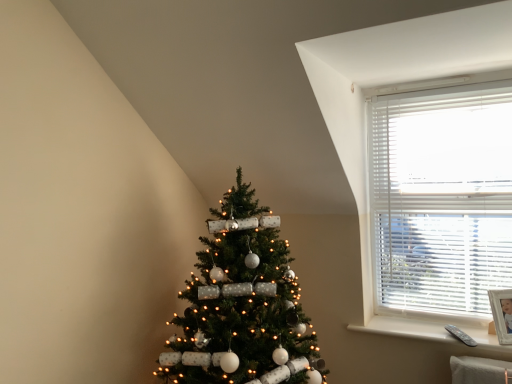
This screenshot has width=512, height=384. I want to click on white blinds at upper right, so click(x=441, y=194).

What do you see at coordinates (406, 328) in the screenshot? The image size is (512, 384). I see `white plastic remote at lower right` at bounding box center [406, 328].

At what (x,y) coordinates should I click in order to perform the action: click on green matte christmas tree at center. Please return your answer as a coordinate pair (x, y). Image resolution: width=512 pixels, height=384 pixels. Looking at the image, I should click on (242, 305).

I want to click on white blinds at upper right, so click(x=441, y=194).

Is white blinds at upper right wider than green matte christmas tree at center?

Incorrect, the width of white blinds at upper right does not surpass that of green matte christmas tree at center.

Consider the image. Would you consider white blinds at upper right to be distant from green matte christmas tree at center?

Actually, white blinds at upper right and green matte christmas tree at center are a little close together.

From the image's perspective, would you say white blinds at upper right is shown under green matte christmas tree at center?

No, from the image's perspective, white blinds at upper right is not beneath green matte christmas tree at center.

Is white blinds at upper right facing towards green matte christmas tree at center?

No, white blinds at upper right does not turn towards green matte christmas tree at center.

Would you say white plastic remote at lower right is inside or outside green matte christmas tree at center?

The correct answer is: outside.

Is white plastic remote at lower right further to camera compared to green matte christmas tree at center?

Yes, white plastic remote at lower right is further from the camera.

Based on the photo, is white plastic remote at lower right to the right of green matte christmas tree at center from the viewer's perspective?

Yes, white plastic remote at lower right is to the right of green matte christmas tree at center.

Between point (431, 339) and point (263, 248), which one is positioned in front?

Point (263, 248)

Considering the positions of points (438, 332) and (463, 220), is point (438, 332) closer to camera compared to point (463, 220)?

Yes.

From the image's perspective, which object appears higher, white plastic remote at lower right or white blinds at upper right?

white blinds at upper right appears higher in the image.

Is white plastic remote at lower right next to white blinds at upper right and touching it?

There is a gap between white plastic remote at lower right and white blinds at upper right.

Which is correct: white blinds at upper right is inside white plastic remote at lower right, or outside of it?

The correct answer is: outside.

From the image's perspective, is white blinds at upper right on white plastic remote at lower right?

Yes, from the image's perspective, white blinds at upper right is above white plastic remote at lower right.

Identify the location of window located above the white plastic remote at lower right (from a real-world perspective). The width and height of the screenshot is (512, 384). (x=441, y=194).

From the image's perspective, which object appears higher, green matte christmas tree at center or white plastic remote at lower right?

green matte christmas tree at center.

Between green matte christmas tree at center and white plastic remote at lower right, which one has less height?

white plastic remote at lower right.

In the scene shown: Considering the positions of objects green matte christmas tree at center and white plastic remote at lower right in the image provided, who is more to the right, green matte christmas tree at center or white plastic remote at lower right?

white plastic remote at lower right is more to the right.

Is green matte christmas tree at center positioned in front of white blinds at upper right?

Yes, green matte christmas tree at center is closer to the camera.

Is green matte christmas tree at center oriented towards white blinds at upper right?

No, green matte christmas tree at center is not facing towards white blinds at upper right.

Based on their sizes in the image, would you say green matte christmas tree at center is bigger or smaller than white blinds at upper right?

In the image, green matte christmas tree at center appears to be larger than white blinds at upper right.

From a real-world perspective, is green matte christmas tree at center positioned over white blinds at upper right based on gravity?

Actually, green matte christmas tree at center is physically below white blinds at upper right in the real world.

Where is `christmas tree lying on the left of white blinds at upper right`? christmas tree lying on the left of white blinds at upper right is located at coordinates (242, 305).

Where is `christmas tree above the white plastic remote at lower right (from the image's perspective)`? This screenshot has width=512, height=384. christmas tree above the white plastic remote at lower right (from the image's perspective) is located at coordinates (242, 305).

Considering their positions, is green matte christmas tree at center positioned further to white plastic remote at lower right than white blinds at upper right?

green matte christmas tree at center is positioned further to the anchor white plastic remote at lower right.

Looking at the image, which one is located closer to white plastic remote at lower right, white blinds at upper right or green matte christmas tree at center?

Among the two, white blinds at upper right is located nearer to white plastic remote at lower right.

Which object lies further to the anchor point green matte christmas tree at center, white blinds at upper right or white plastic remote at lower right?

white blinds at upper right.

From the image, which object appears to be nearer to green matte christmas tree at center, white plastic remote at lower right or white blinds at upper right?

white plastic remote at lower right is closer to green matte christmas tree at center.

Looking at the image, which one is located further to white blinds at upper right, white plastic remote at lower right or green matte christmas tree at center?

green matte christmas tree at center is further to white blinds at upper right.

From the image, which object appears to be farther from white blinds at upper right, green matte christmas tree at center or white plastic remote at lower right?

green matte christmas tree at center lies further to white blinds at upper right than the other object.

Locate an element on the screen. window sill between green matte christmas tree at center and white blinds at upper right is located at coordinates (406, 328).